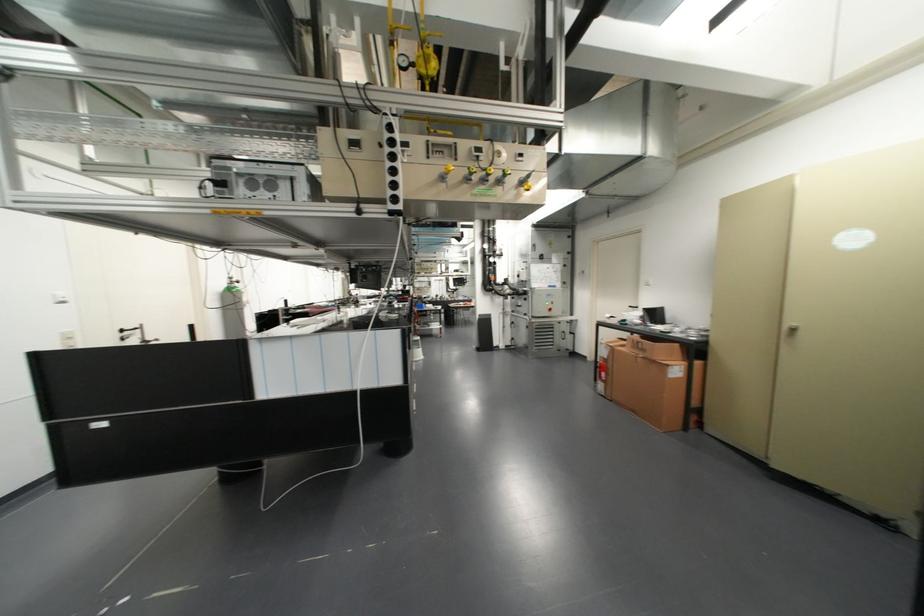
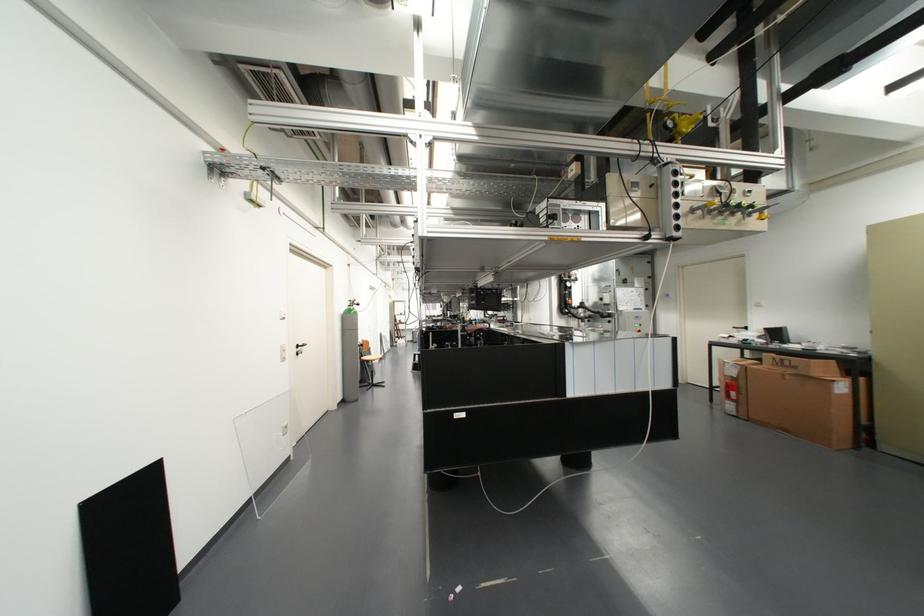
Question: In a continuous first-person perspective shot, in which direction is the camera moving?

Choices:
 (A) Left
 (B) Right
 (C) Forward
 (D) Backward

Answer: (A)